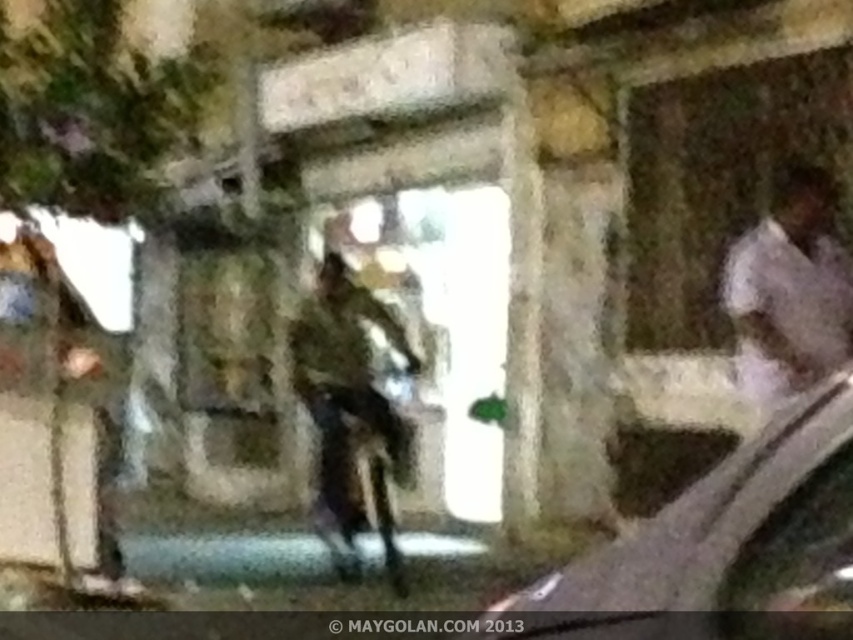
Question: Which point is farther to the camera?

Choices:
 (A) (793, 328)
 (B) (764, 461)
 (C) (370, 429)

Answer: (C)

Question: Can you confirm if camouflage fabric uniform at center is positioned to the left of white fabric shirt at right?

Choices:
 (A) no
 (B) yes

Answer: (B)

Question: In this image, where is metallic silver car at center located relative to white fabric shirt at right?

Choices:
 (A) below
 (B) above

Answer: (A)

Question: Considering the relative positions of camouflage fabric uniform at center and white fabric shirt at right in the image provided, where is camouflage fabric uniform at center located with respect to white fabric shirt at right?

Choices:
 (A) right
 (B) left

Answer: (B)

Question: Which object appears farthest from the camera in this image?

Choices:
 (A) camouflage fabric uniform at center
 (B) white fabric shirt at right
 (C) metallic silver car at center

Answer: (A)

Question: Which object is farther from the camera taking this photo?

Choices:
 (A) metallic silver car at center
 (B) white fabric shirt at right
 (C) camouflage fabric uniform at center

Answer: (C)